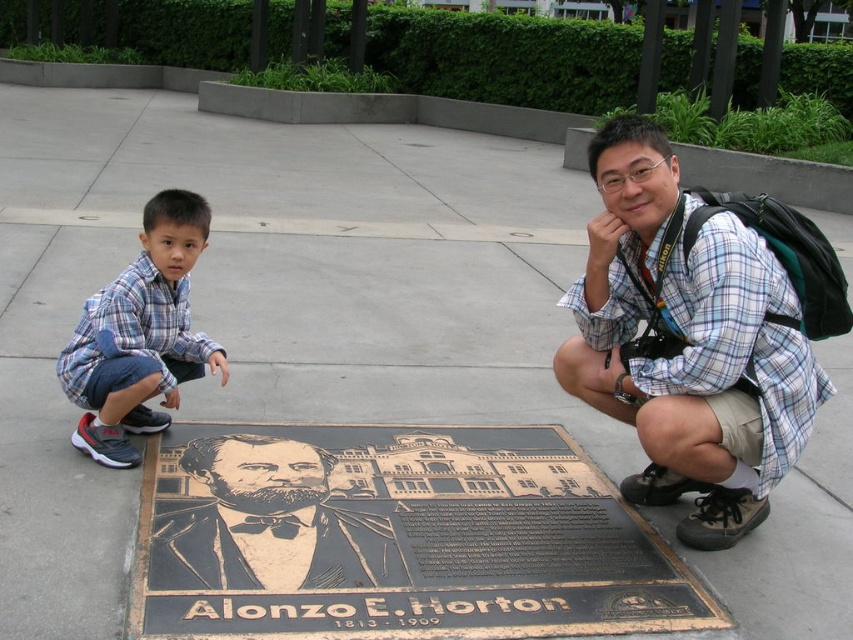
Question: Among these points, which one is nearest to the camera?

Choices:
 (A) (756, 358)
 (B) (260, 577)

Answer: (B)

Question: Is plaid shirt at center thinner than matte bronze portrait at center?

Choices:
 (A) yes
 (B) no

Answer: (A)

Question: Is the position of plaid shirt at center less distant than that of blue plaid shirt at left?

Choices:
 (A) yes
 (B) no

Answer: (A)

Question: Which of the following is the farthest from the observer?

Choices:
 (A) blue plaid shirt at left
 (B) matte bronze portrait at center
 (C) plaid shirt at center

Answer: (A)

Question: Is plaid shirt at center to the left of matte bronze portrait at center from the viewer's perspective?

Choices:
 (A) yes
 (B) no

Answer: (B)

Question: Which of the following is the farthest from the observer?

Choices:
 (A) plaid shirt at center
 (B) matte bronze portrait at center
 (C) blue plaid shirt at left

Answer: (C)